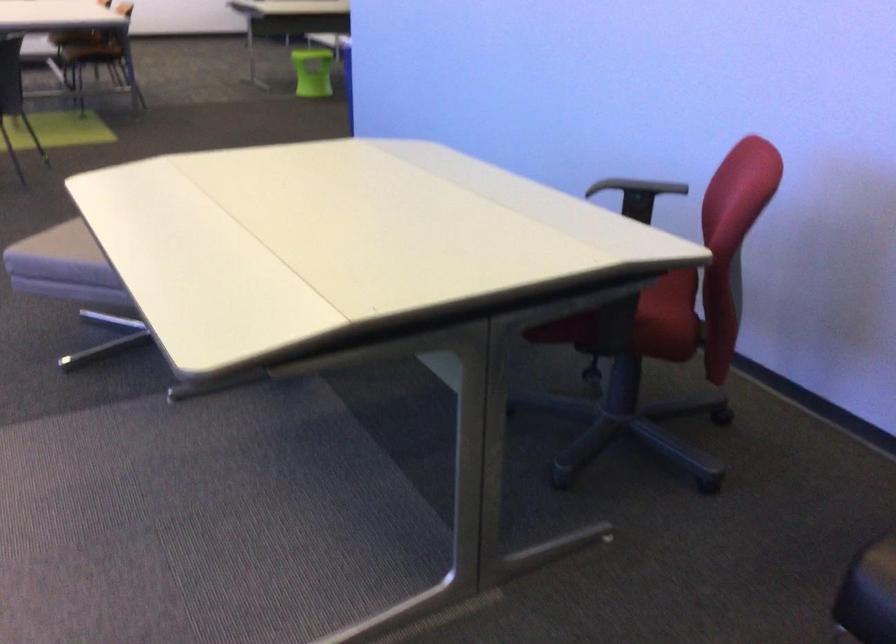
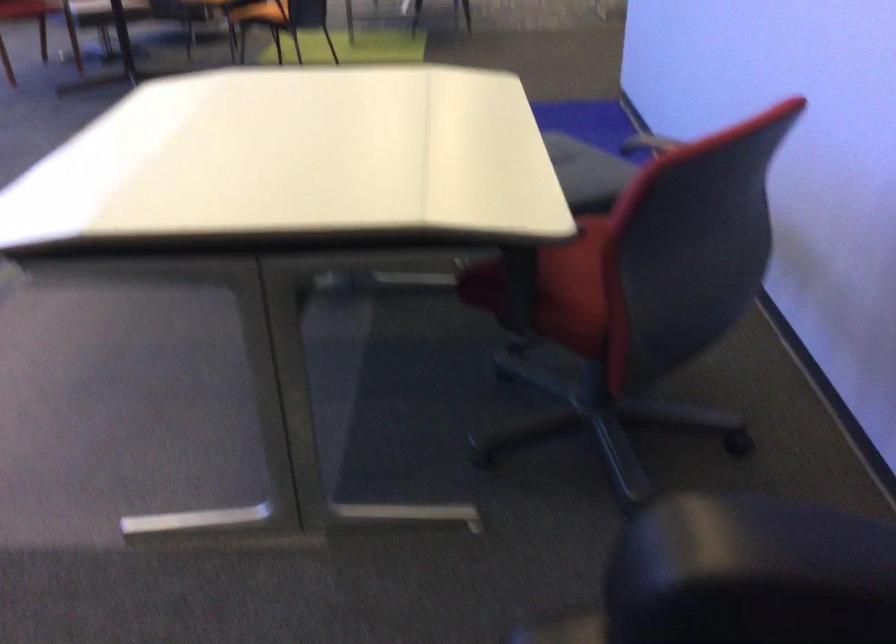
Question: The images are taken continuously from a first-person perspective. In which direction are you moving?

Choices:
 (A) Left
 (B) Right
 (C) Forward
 (D) Backward

Answer: (B)